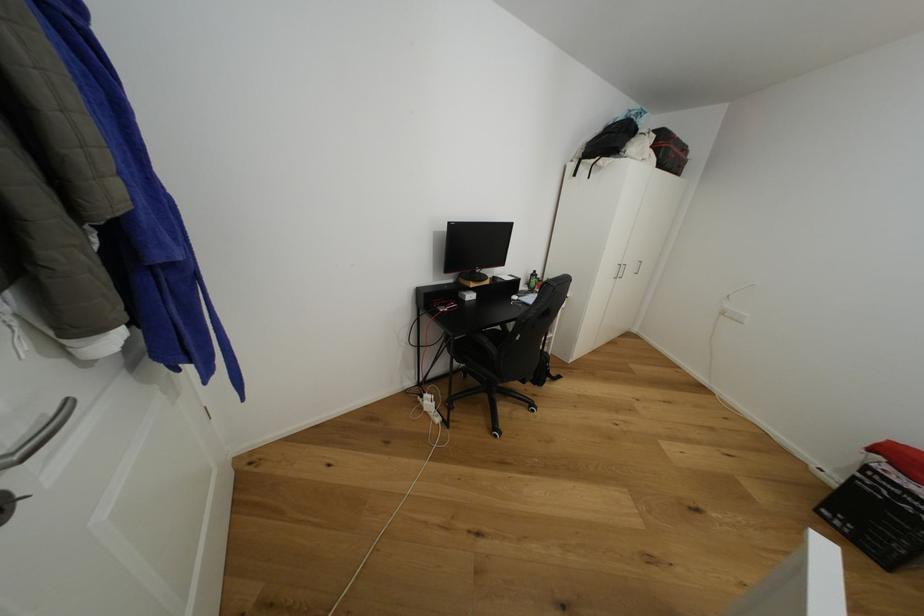
This screenshot has width=924, height=616. I want to click on chair armrest, so click(489, 342).